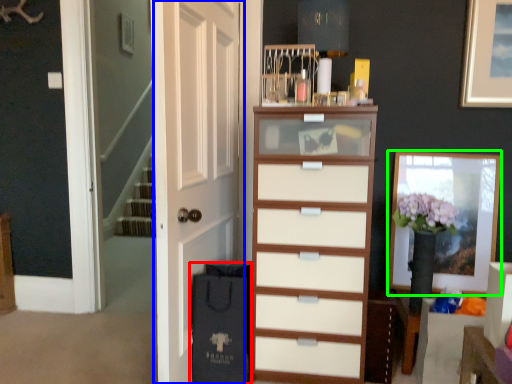
Question: Based on their relative distances, which object is nearer to shopping bag (highlighted by a red box)? Choose from door (highlighted by a blue box) and picture frame (highlighted by a green box).

Choices:
 (A) door
 (B) picture frame

Answer: (A)